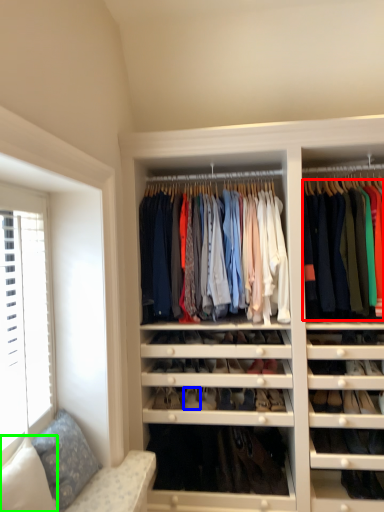
Question: Which object is the closest to the clothing (highlighted by a red box)? Choose among these: shoe (highlighted by a blue box) or pillow (highlighted by a green box).

Choices:
 (A) shoe
 (B) pillow

Answer: (A)